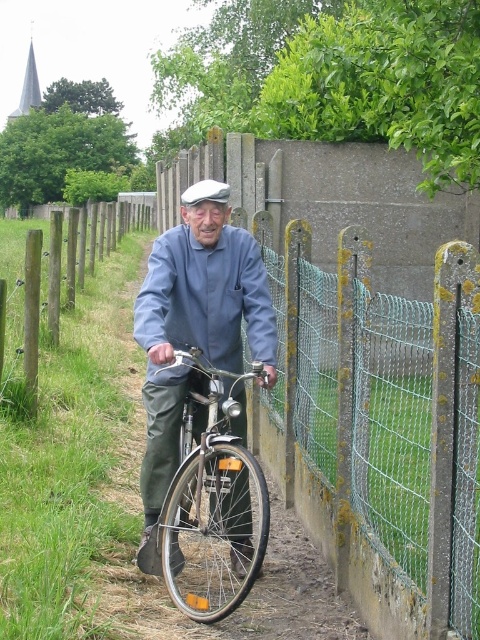
You are a photographer trying to capture a clear photo of the matte blue shirt at center and the matte blue bicycle at center. Since both are blue, you want to ensure they are distinguishable in the photo. Which object should you focus on first to make sure it appears sharp in the foreground?

The matte blue shirt at center should be focused on first because the matte blue bicycle at center is behind it, so focusing on the shirt will keep it sharp in the foreground while the bicycle may appear slightly blurred but still visible in the background.

Looking at this image, you are a photographer planning to take a portrait of the elderly man and his bicycle. You want to ensure the matte blue shirt at center and the shiny silver bicycle at center are both clearly visible in the frame. Based on their positions, which object should you focus on first to ensure both are in focus?

The matte blue shirt at center is above the shiny silver bicycle at center, so focusing on the shirt first will ensure both are in focus since it is closer to the camera.

You are a delivery person who needs to place a package on the ground near the point marked at coordinates (245,600). The package must be placed on a surface that is not grassy. Is there a suitable surface available at that point?

The point at coordinates (245,600) has a matte blue bicycle at center. The bicycle is an object, so the ground beneath it might be the narrow path which is non grassy. However, since the bicycle is present there, placing the package directly under it may not be feasible. The nearest non grassy surfaces would likely be the narrow path itself near the bicycle or the concrete wall nearby. Since the question specifies placing near the marked point, the narrow path surface there is non grassy and suitable.